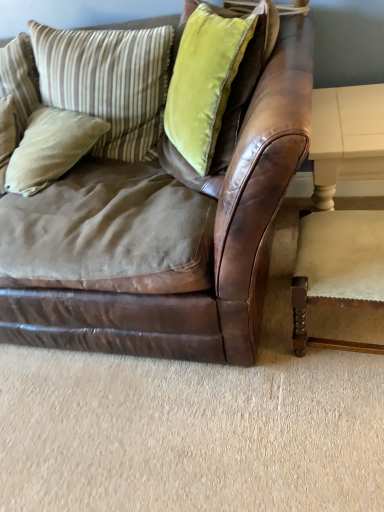
Measure the distance between point (x=287, y=139) and camera.

Point (x=287, y=139) is 29.96 inches away from camera.

How much space does striped fabric pillow at upper left, acting as the third pillow starting from the left, occupy vertically?

striped fabric pillow at upper left, acting as the third pillow starting from the left, is 56.17 centimeters in height.

The image size is (384, 512). What do you see at coordinates (337, 270) in the screenshot?
I see `beige fabric chair at lower right` at bounding box center [337, 270].

Where is `velvet green pillow at upper center, which is the 4th pillow from left to right`? This screenshot has height=512, width=384. velvet green pillow at upper center, which is the 4th pillow from left to right is located at coordinates coord(204,82).

From a real-world perspective, between striped fabric pillow at upper left, which ranks as the 2th pillow in right-to-left order, and beige fabric chair at lower right, who is vertically higher?

striped fabric pillow at upper left, which ranks as the 2th pillow in right-to-left order.

Would you say striped fabric pillow at upper left, acting as the third pillow starting from the left, is outside beige fabric chair at lower right?

Indeed, striped fabric pillow at upper left, acting as the third pillow starting from the left, is completely outside beige fabric chair at lower right.

Which is in front, point (56, 31) or point (377, 231)?

Positioned in front is point (377, 231).

Can you confirm if striped fabric pillow at upper left, acting as the third pillow starting from the left, is smaller than beige fabric chair at lower right?

No, striped fabric pillow at upper left, acting as the third pillow starting from the left, is not smaller than beige fabric chair at lower right.

Consider the image. Is brown leather couch at center aimed at striped fabric pillow at upper left, which ranks as the 2th pillow in right-to-left order?

Yes, brown leather couch at center is turned towards striped fabric pillow at upper left, which ranks as the 2th pillow in right-to-left order.

Locate an element on the screen. The image size is (384, 512). studio couch lying below the striped fabric pillow at upper left, which ranks as the 2th pillow in right-to-left order (from the image's perspective) is located at coordinates (161, 238).

Which of these two, brown leather couch at center or striped fabric pillow at upper left, acting as the third pillow starting from the left, is wider?

brown leather couch at center is wider.

Is white painted wood table at right to the right of striped fabric pillow at upper left, which ranks as the 2th pillow in right-to-left order, from the viewer's perspective?

Correct, you'll find white painted wood table at right to the right of striped fabric pillow at upper left, which ranks as the 2th pillow in right-to-left order.

From a real-world perspective, is white painted wood table at right on striped fabric pillow at upper left, which ranks as the 2th pillow in right-to-left order?

No, from a real-world perspective, white painted wood table at right is not on top of striped fabric pillow at upper left, which ranks as the 2th pillow in right-to-left order.

Considering the positions of objects white painted wood table at right and striped fabric pillow at upper left, which ranks as the 2th pillow in right-to-left order, in the image provided, who is in front, white painted wood table at right or striped fabric pillow at upper left, which ranks as the 2th pillow in right-to-left order,?

white painted wood table at right is more forward.

Starting from the white painted wood table at right, which pillow is the 2nd one to the left? Please provide its 2D coordinates.

[(108, 81)]

In terms of size, does striped fabric pillow at upper left, which ranks as the 2th pillow in right-to-left order, appear bigger or smaller than beige cotton pillow at left, which is counted as the third pillow, starting from the right?

striped fabric pillow at upper left, which ranks as the 2th pillow in right-to-left order, is bigger than beige cotton pillow at left, which is counted as the third pillow, starting from the right.

Can you tell me how much striped fabric pillow at upper left, acting as the third pillow starting from the left, and beige cotton pillow at left, which is counted as the third pillow, starting from the right, differ in facing direction?

There is a 19.7-degree angle between the facing directions of striped fabric pillow at upper left, acting as the third pillow starting from the left, and beige cotton pillow at left, which is counted as the third pillow, starting from the right.

Can you confirm if striped fabric pillow at upper left, acting as the third pillow starting from the left, is positioned to the left of beige cotton pillow at left, the 2th pillow viewed from the left?

In fact, striped fabric pillow at upper left, acting as the third pillow starting from the left, is to the right of beige cotton pillow at left, the 2th pillow viewed from the left.

Is beige cotton pillow at left, which is counted as the third pillow, starting from the right, to the right of velvet green pillow at upper center, the first pillow when ordered from right to left, from the viewer's perspective?

In fact, beige cotton pillow at left, which is counted as the third pillow, starting from the right, is to the left of velvet green pillow at upper center, the first pillow when ordered from right to left.

Is beige cotton pillow at left, the 2th pillow viewed from the left, positioned far away from velvet green pillow at upper center, which is the 4th pillow from left to right?

beige cotton pillow at left, the 2th pillow viewed from the left, is actually quite close to velvet green pillow at upper center, which is the 4th pillow from left to right.

Is beige cotton pillow at left, the 2th pillow viewed from the left, positioned with its back to velvet green pillow at upper center, the first pillow when ordered from right to left?

No, velvet green pillow at upper center, the first pillow when ordered from right to left, is not at the back of beige cotton pillow at left, the 2th pillow viewed from the left.

In the scene shown: Is beige cotton pillow at left, the 2th pillow viewed from the left, inside the boundaries of velvet green pillow at upper center, the first pillow when ordered from right to left, or outside?

beige cotton pillow at left, the 2th pillow viewed from the left, cannot be found inside velvet green pillow at upper center, the first pillow when ordered from right to left.

From the image's perspective, would you say brown leather couch at center is positioned over striped fabric pillow at upper left, which ranks as the 4th pillow in right-to-left order?

No.

Between brown leather couch at center and striped fabric pillow at upper left, which is counted as the 1th pillow, starting from the left, which one has smaller size?

With smaller size is striped fabric pillow at upper left, which is counted as the 1th pillow, starting from the left.

Who is taller, brown leather couch at center or striped fabric pillow at upper left, which ranks as the 4th pillow in right-to-left order?

Standing taller between the two is brown leather couch at center.

Are striped fabric pillow at upper left, which ranks as the 2th pillow in right-to-left order, and white painted wood table at right located far from each other?

They are positioned close to each other.

Which of these two, striped fabric pillow at upper left, acting as the third pillow starting from the left, or white painted wood table at right, is bigger?

With larger size is striped fabric pillow at upper left, acting as the third pillow starting from the left.

Does striped fabric pillow at upper left, which ranks as the 2th pillow in right-to-left order, turn towards white painted wood table at right?

No.

From the image's perspective, relative to white painted wood table at right, is striped fabric pillow at upper left, which ranks as the 2th pillow in right-to-left order, above or below?

striped fabric pillow at upper left, which ranks as the 2th pillow in right-to-left order, is situated higher than white painted wood table at right in the image.

From the beige fabric chair at lower right, count 1st pillows backward and point to it. Please provide its 2D coordinates.

[(108, 81)]

The height and width of the screenshot is (512, 384). Identify the location of the 2nd pillow located above the brown leather couch at center (from a real-world perspective). (108, 81).

Looking at the image, which one is located further to beige fabric chair at lower right, beige cotton pillow at left, which is counted as the third pillow, starting from the right, or white painted wood table at right?

Based on the image, beige cotton pillow at left, which is counted as the third pillow, starting from the right, appears to be further to beige fabric chair at lower right.

When comparing their distances from velvet green pillow at upper center, which is the 4th pillow from left to right, does beige fabric chair at lower right or brown leather couch at center seem closer?

Among the two, brown leather couch at center is located nearer to velvet green pillow at upper center, which is the 4th pillow from left to right.

In the scene shown: Estimate the real-world distances between objects in this image. Which object is closer to beige fabric chair at lower right, velvet green pillow at upper center, which is the 4th pillow from left to right, or brown leather couch at center?

brown leather couch at center is closer to beige fabric chair at lower right.

Based on their spatial positions, is striped fabric pillow at upper left, acting as the third pillow starting from the left, or beige cotton pillow at left, which is counted as the third pillow, starting from the right, further from brown leather couch at center?

striped fabric pillow at upper left, acting as the third pillow starting from the left.

Looking at the image, which one is located further to velvet green pillow at upper center, the first pillow when ordered from right to left, beige fabric chair at lower right or beige cotton pillow at left, the 2th pillow viewed from the left?

Based on the image, beige fabric chair at lower right appears to be further to velvet green pillow at upper center, the first pillow when ordered from right to left.

When comparing their distances from velvet green pillow at upper center, which is the 4th pillow from left to right, does beige cotton pillow at left, which is counted as the third pillow, starting from the right, or white painted wood table at right seem further?

beige cotton pillow at left, which is counted as the third pillow, starting from the right.

Looking at the image, which one is located closer to striped fabric pillow at upper left, acting as the third pillow starting from the left, white painted wood table at right or striped fabric pillow at upper left, which is counted as the 1th pillow, starting from the left?

striped fabric pillow at upper left, which is counted as the 1th pillow, starting from the left, is positioned closer to the anchor striped fabric pillow at upper left, acting as the third pillow starting from the left.

Estimate the real-world distances between objects in this image. Which object is closer to beige fabric chair at lower right, striped fabric pillow at upper left, which ranks as the 4th pillow in right-to-left order, or striped fabric pillow at upper left, which ranks as the 2th pillow in right-to-left order?

striped fabric pillow at upper left, which ranks as the 2th pillow in right-to-left order, is closer to beige fabric chair at lower right.

This screenshot has width=384, height=512. In order to click on studio couch between striped fabric pillow at upper left, which ranks as the 4th pillow in right-to-left order, and beige fabric chair at lower right from left to right in this screenshot , I will do `click(161, 238)`.

You are a GUI agent. You are given a task and a screenshot of the screen. Output one action in this format:
    pyautogui.click(x=<x>, y=<y>)
    Task: Click on the pillow situated between striped fabric pillow at upper left, which ranks as the 2th pillow in right-to-left order, and white painted wood table at right from left to right
    
    Given the screenshot: What is the action you would take?
    pyautogui.click(x=204, y=82)

Locate an element on the screen. The width and height of the screenshot is (384, 512). pillow between striped fabric pillow at upper left, which ranks as the 4th pillow in right-to-left order, and striped fabric pillow at upper left, which ranks as the 2th pillow in right-to-left order, from left to right is located at coordinates (50, 148).

This screenshot has width=384, height=512. I want to click on pillow between beige cotton pillow at left, which is counted as the third pillow, starting from the right, and velvet green pillow at upper center, which is the 4th pillow from left to right, in the horizontal direction, so click(108, 81).